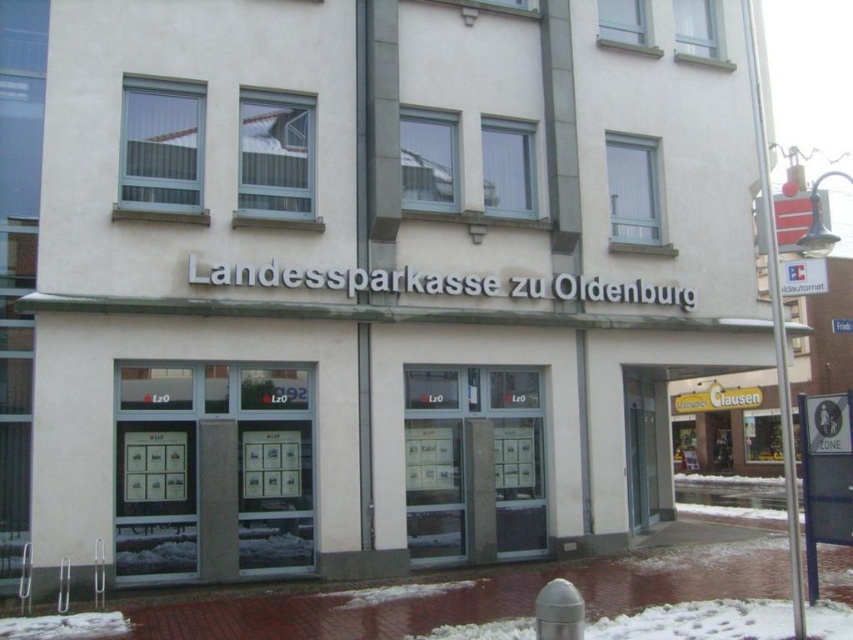
In the scene shown: Can you confirm if transparent glass windows at center is positioned to the left of transparent glass doors at center?

Yes, transparent glass windows at center is to the left of transparent glass doors at center.

Does transparent glass windows at center come in front of transparent glass doors at center?

Yes, transparent glass windows at center is in front of transparent glass doors at center.

Is point (310, 522) farther from camera compared to point (427, 396)?

No, (310, 522) is closer to viewer.

You are a GUI agent. You are given a task and a screenshot of the screen. Output one action in this format:
    pyautogui.click(x=<x>, y=<y>)
    Task: Click on the transparent glass windows at center
    This screenshot has height=640, width=853.
    Given the screenshot: What is the action you would take?
    pyautogui.click(x=223, y=465)